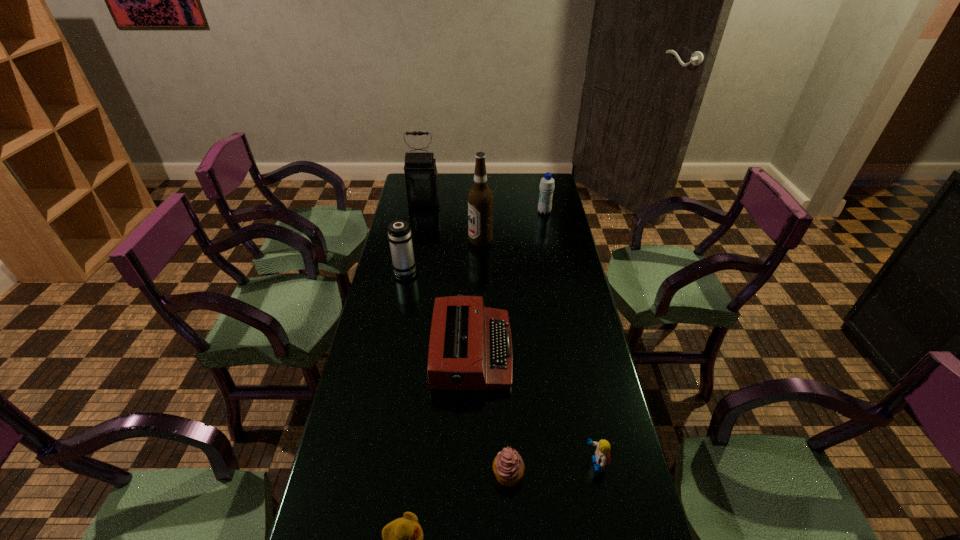
I want to click on free space located 0.160m on the left of the cupcake, so click(x=428, y=474).

Where is `object at the far edge`? This screenshot has height=540, width=960. object at the far edge is located at coordinates (421, 181).

This screenshot has height=540, width=960. I want to click on lantern at the left edge, so click(421, 181).

The image size is (960, 540). I want to click on thermos bottle at the left edge, so click(399, 235).

You are a GUI agent. You are given a task and a screenshot of the screen. Output one action in this format:
    pyautogui.click(x=<x>, y=<y>)
    Task: Click on the water bottle located at the right edge
    The width and height of the screenshot is (960, 540).
    Given the screenshot: What is the action you would take?
    pyautogui.click(x=546, y=185)

At what (x,y) coordinates should I click in order to perform the action: click on Lego located at the right edge. Please return your answer as a coordinate pair (x, y). The width and height of the screenshot is (960, 540). Looking at the image, I should click on (602, 453).

At what (x,y) coordinates should I click in order to perform the action: click on object located at the far left corner. Please return your answer as a coordinate pair (x, y). The image size is (960, 540). Looking at the image, I should click on (421, 181).

The image size is (960, 540). Identify the location of free space at the left edge. [x=386, y=280].

The image size is (960, 540). Identify the location of blank space at the right edge of the desktop. (539, 214).

The width and height of the screenshot is (960, 540). I want to click on vacant space at the far left corner, so click(x=405, y=195).